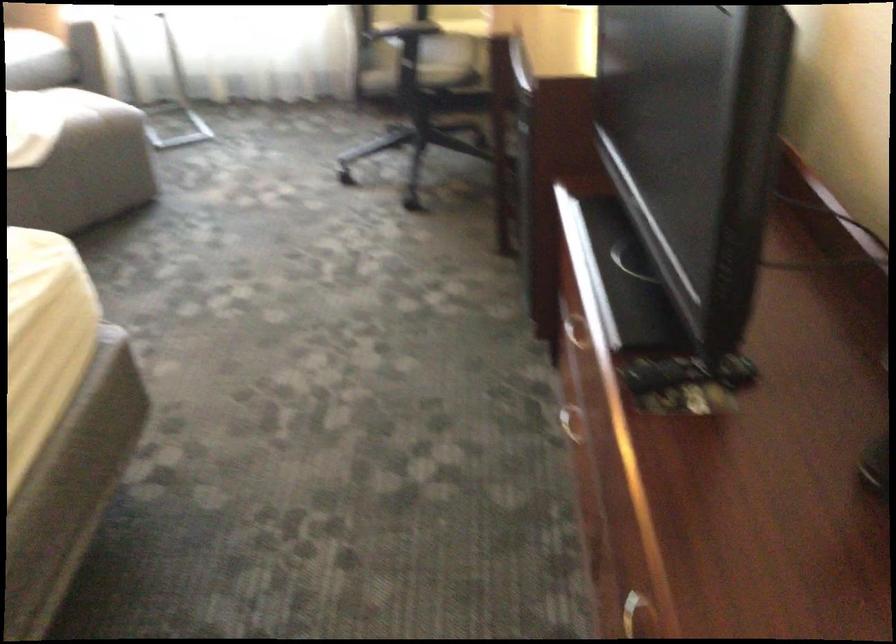
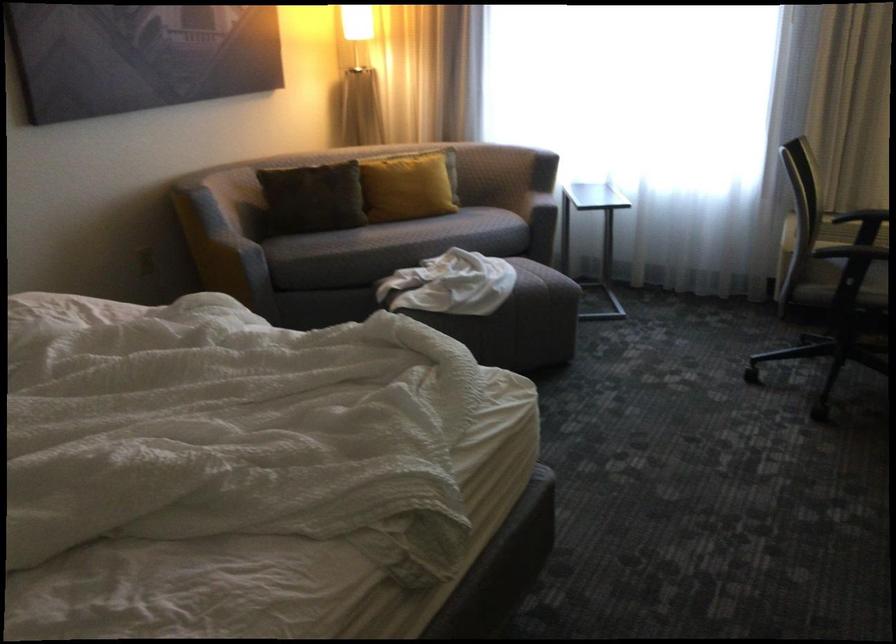
The point at (399, 80) is marked in the first image. Where is the corresponding point in the second image?

(831, 294)